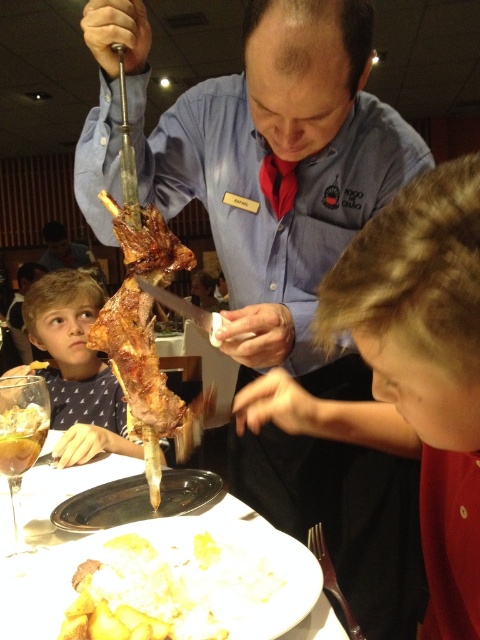
Between brown hair at upper right and white glossy plate at center, which one is positioned higher?

brown hair at upper right

Who is positioned more to the left, brown hair at upper right or white glossy plate at center?

Positioned to the left is white glossy plate at center.

Which is in front, point (468, 476) or point (34, 468)?

Positioned in front is point (468, 476).

Locate an element on the screen. This screenshot has height=640, width=480. brown hair at upper right is located at coordinates (408, 371).

Does polka dot shirt at lower left have a larger size compared to metallic silver fork at lower center?

Yes, polka dot shirt at lower left is bigger than metallic silver fork at lower center.

Which is in front, point (68, 291) or point (324, 561)?

Point (324, 561) is more forward.

Locate an element on the screen. This screenshot has height=640, width=480. polka dot shirt at lower left is located at coordinates (76, 369).

Can you confirm if brown hair at upper right is positioned to the right of polka dot shirt at lower left?

Yes, brown hair at upper right is to the right of polka dot shirt at lower left.

Is the position of brown hair at upper right more distant than that of polka dot shirt at lower left?

No, brown hair at upper right is in front of polka dot shirt at lower left.

Between point (375, 385) and point (59, 401), which one is positioned behind?

Positioned behind is point (59, 401).

Locate an element on the screen. Image resolution: width=480 pixels, height=640 pixels. brown hair at upper right is located at coordinates (408, 371).